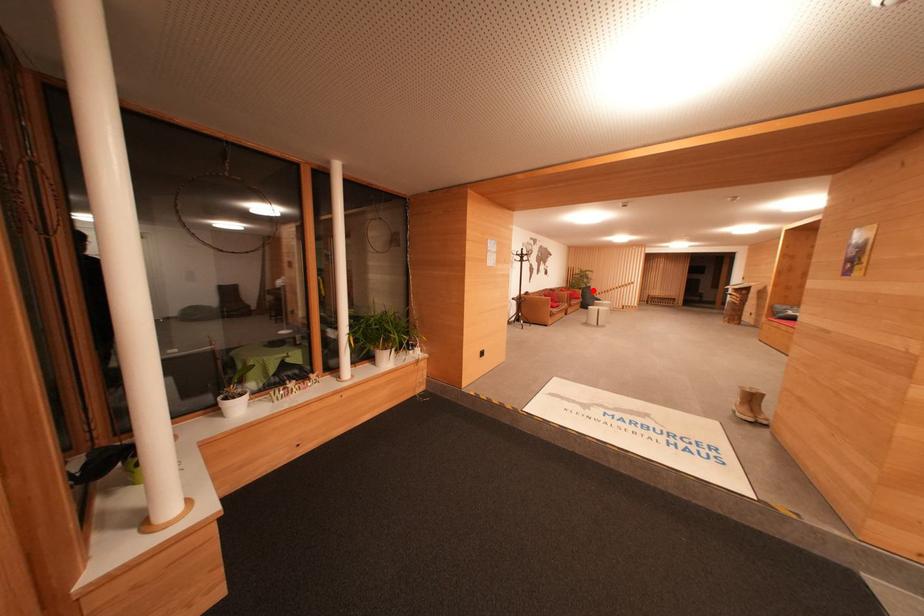
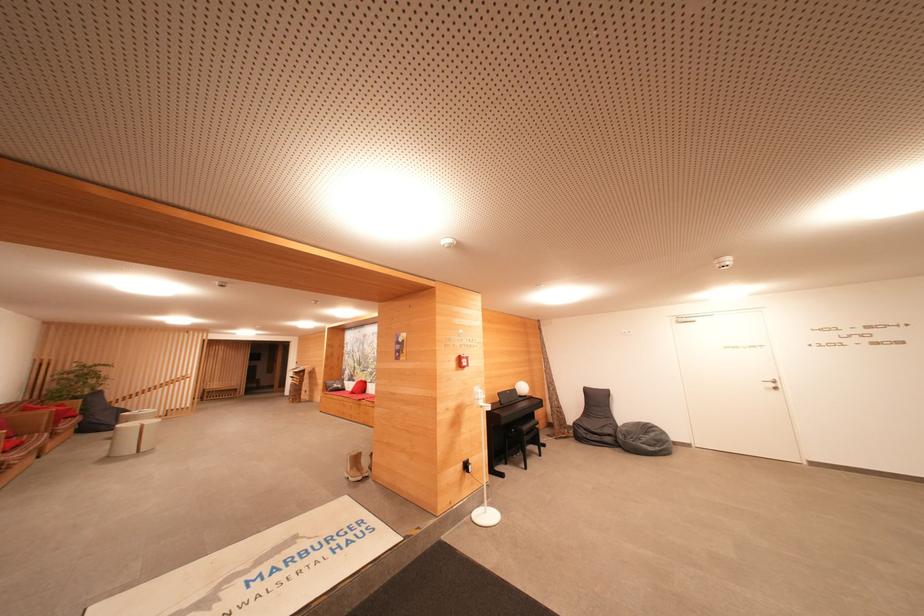
Find the pixel in the second image that matches the highlighted location in the first image.

(103, 395)